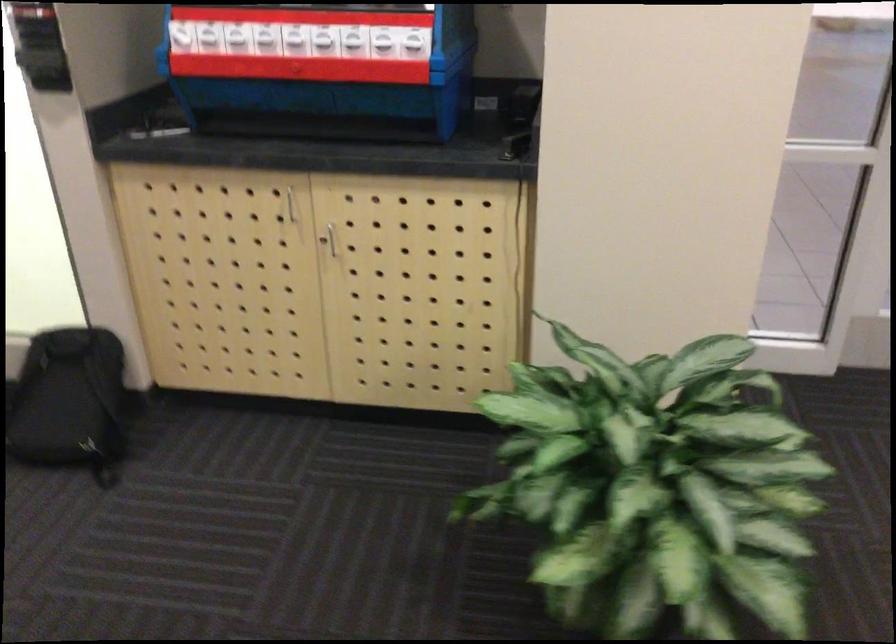
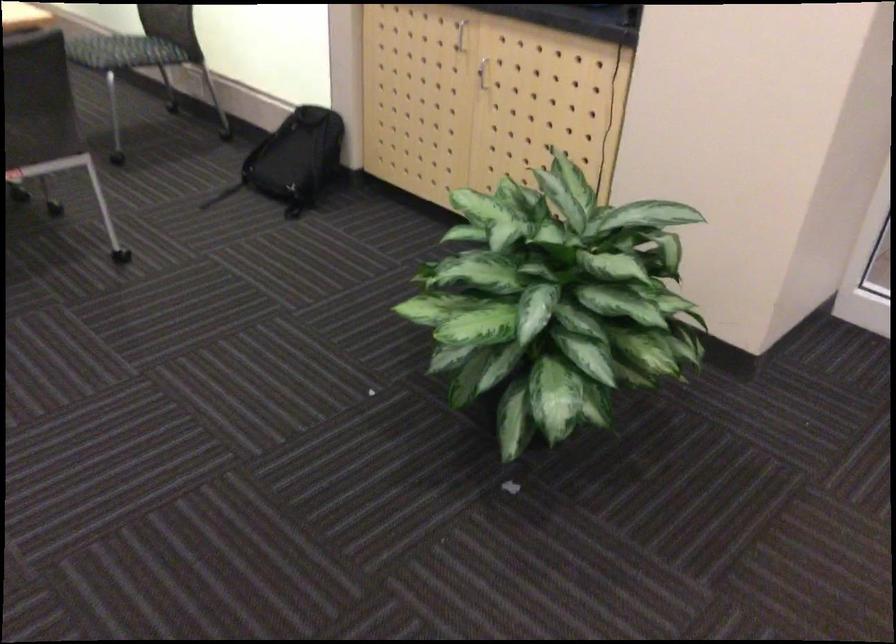
Find the pixel in the second image that matches point (88, 404) in the first image.

(293, 160)